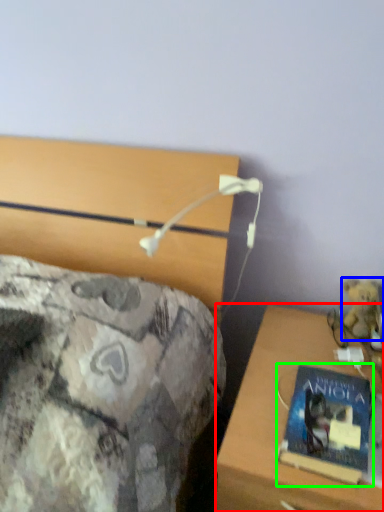
Question: Which is nearer to the desk (highlighted by a red box)? teddy bear (highlighted by a blue box) or book (highlighted by a green box).

Choices:
 (A) teddy bear
 (B) book

Answer: (B)